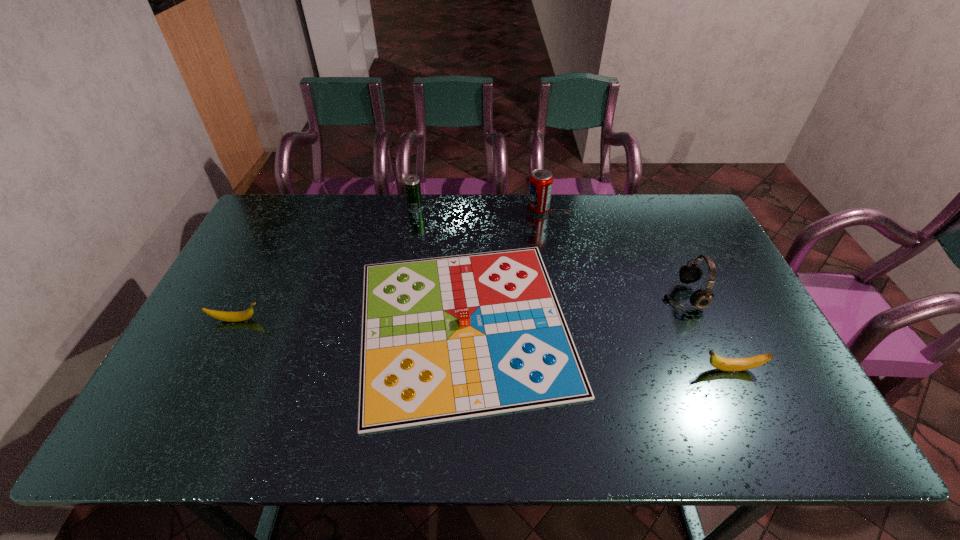
Where is `free spot located with the microphone on the side of the headset`? Image resolution: width=960 pixels, height=540 pixels. free spot located with the microphone on the side of the headset is located at coordinates (x=546, y=296).

I want to click on vacant space located on the right of the fourth shortest object, so click(462, 207).

Find the location of a particular element. vacant position located 0.260m at the stem of the right banana is located at coordinates (593, 369).

Where is `vacant point located 0.240m at the stem of the right banana`? The height and width of the screenshot is (540, 960). vacant point located 0.240m at the stem of the right banana is located at coordinates (602, 369).

The image size is (960, 540). Find the location of `vacant region located 0.250m at the stem of the right banana`. vacant region located 0.250m at the stem of the right banana is located at coordinates [597, 369].

Where is `vacant space positioned at the stem of the leftmost object`? vacant space positioned at the stem of the leftmost object is located at coordinates pyautogui.click(x=301, y=320).

I want to click on vacant space located on the back of the shortest object, so [468, 221].

Find the location of `soda can located at the far edge`. soda can located at the far edge is located at coordinates (541, 180).

Identify the location of beer can that is at the far edge. This screenshot has height=540, width=960. (412, 183).

The image size is (960, 540). Find the location of `object that is at the near edge`. object that is at the near edge is located at coordinates (446, 338).